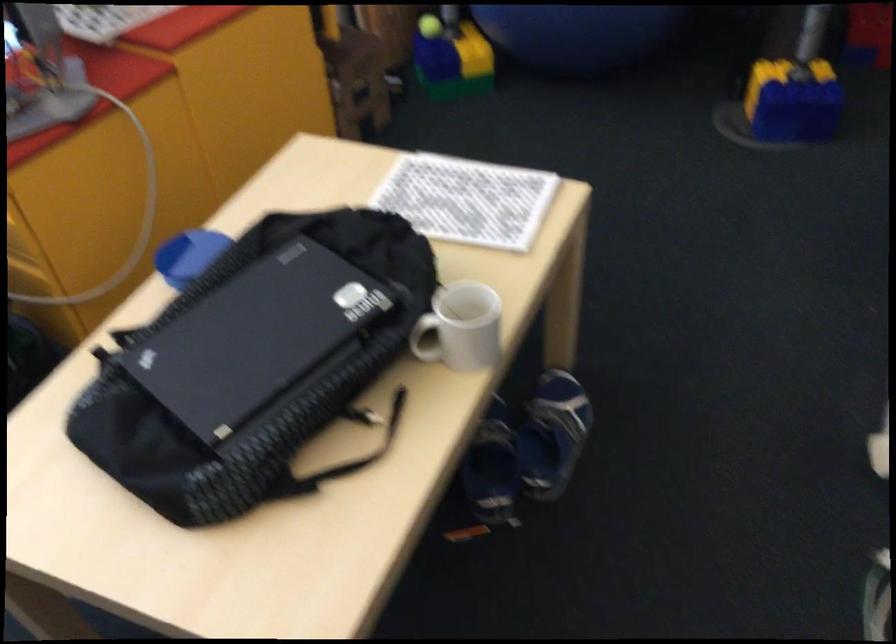
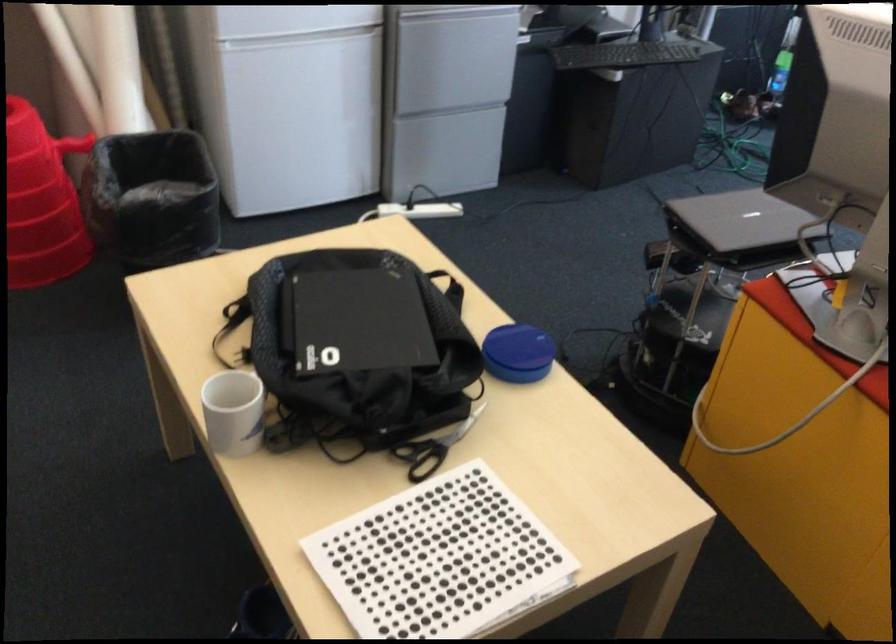
In the second image, find the point that corresponds to pixel 340 494 in the first image.

(229, 325)